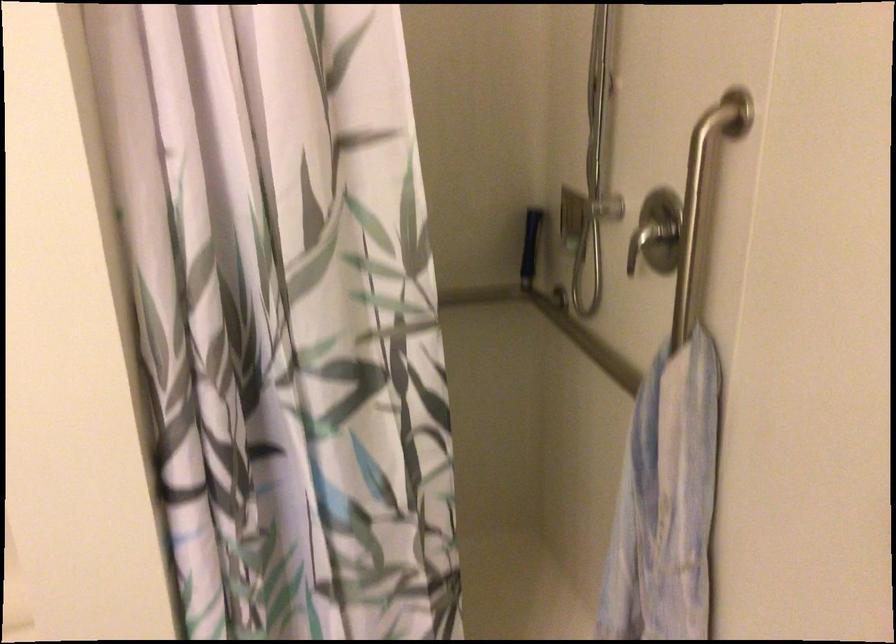
The image size is (896, 644). I want to click on horizontal grab bar, so click(x=586, y=341).